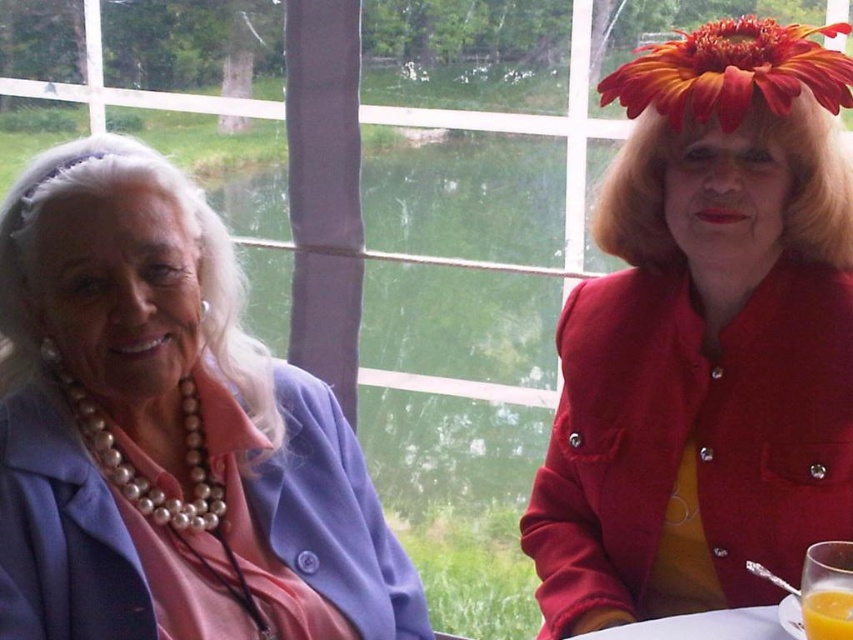
You are a guest at this table and want to grab the translucent glass cup at lower right without touching the matte red coat at right. Is this possible?

The matte red coat at right is above the translucent glass cup at lower right, so you can reach the cup by carefully moving under the coat without touching it.